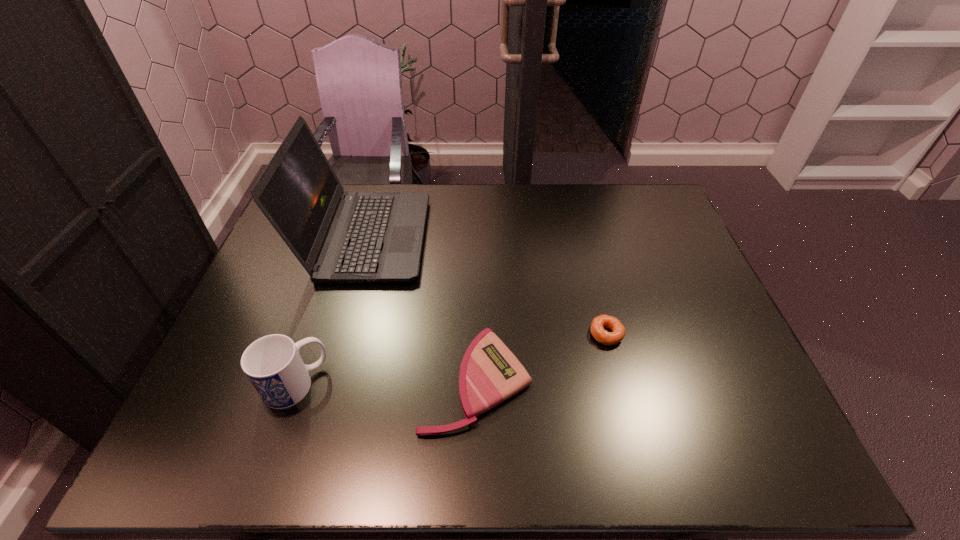
Find the location of a particular element. This screenshot has width=960, height=540. object that is the nearest to the farthest object is located at coordinates (490, 373).

The image size is (960, 540). What are the coordinates of `object that is the second closest one to the third object from left to right` in the screenshot? It's located at (338, 237).

Where is `vacant area that satisfies the following two spatial constraints: 1. on the back side of the third shortest object; 2. on the left side of the second object from right to left`? This screenshot has width=960, height=540. vacant area that satisfies the following two spatial constraints: 1. on the back side of the third shortest object; 2. on the left side of the second object from right to left is located at coordinates (297, 381).

The width and height of the screenshot is (960, 540). I want to click on vacant region that satisfies the following two spatial constraints: 1. on the screen of the farthest object; 2. on the back side of the third object from left to right, so click(x=326, y=381).

What are the coordinates of `free space that satisfies the following two spatial constraints: 1. on the screen of the laptop_computer; 2. on the back side of the wristlet` in the screenshot? It's located at (326, 381).

This screenshot has height=540, width=960. I want to click on vacant space that satisfies the following two spatial constraints: 1. on the screen of the farthest object; 2. on the front side of the mug, so click(x=325, y=384).